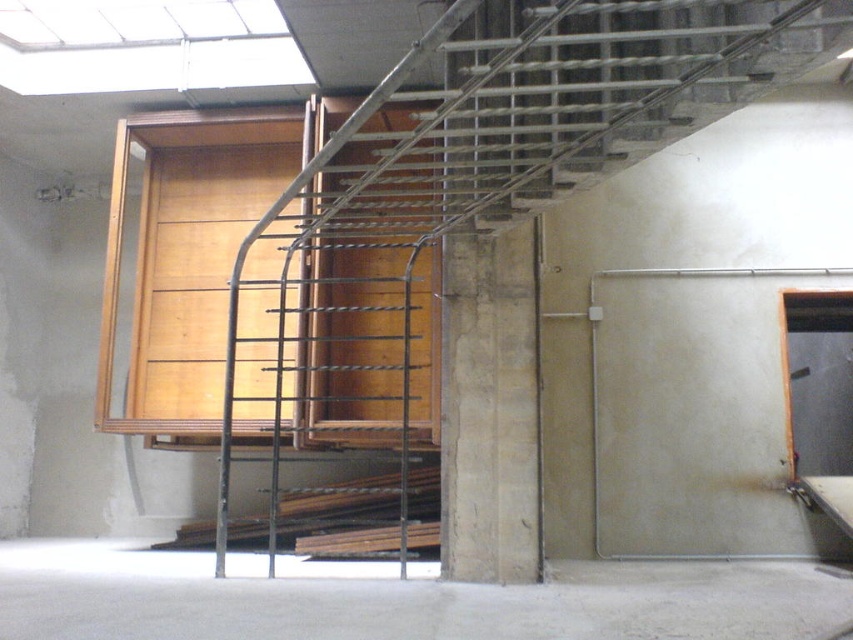
Who is taller, metallic gray ladder at center or concrete floor at lower center?

metallic gray ladder at center is taller.

Does point (582, 54) come closer to viewer compared to point (412, 627)?

No.

Is point (509, 6) positioned before point (386, 621)?

No, it is behind (386, 621).

Locate an element on the screen. metallic gray ladder at center is located at coordinates (514, 131).